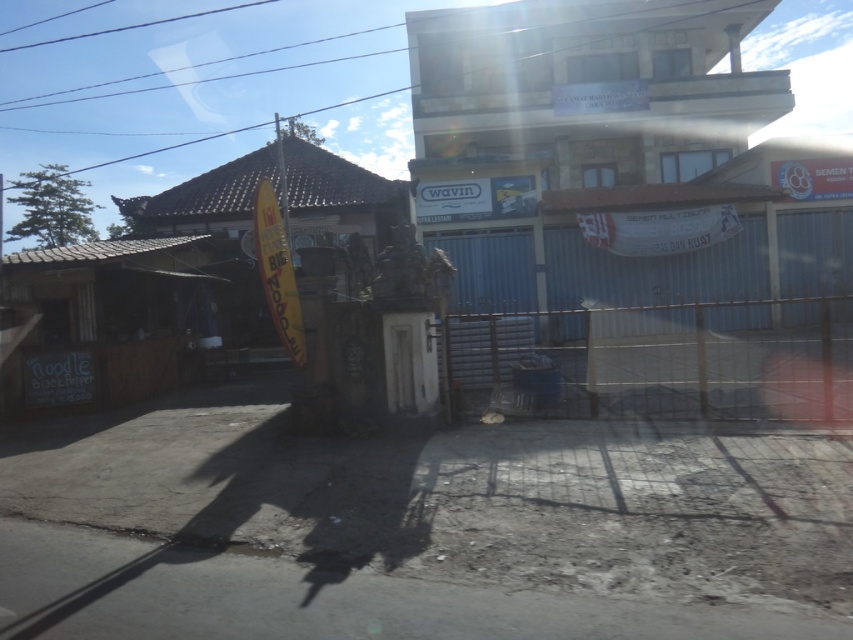
Question: Among these points, which one is farthest from the camera?

Choices:
 (A) pyautogui.click(x=759, y=362)
 (B) pyautogui.click(x=444, y=630)

Answer: (A)

Question: Which object is farther from the camera taking this photo?

Choices:
 (A) dirt track at lower center
 (B) metallic gate at center

Answer: (B)

Question: Does dirt track at lower center come in front of metallic gate at center?

Choices:
 (A) yes
 (B) no

Answer: (A)

Question: Does dirt track at lower center have a lesser width compared to metallic gate at center?

Choices:
 (A) no
 (B) yes

Answer: (B)

Question: Is dirt track at lower center further to the viewer compared to metallic gate at center?

Choices:
 (A) no
 (B) yes

Answer: (A)